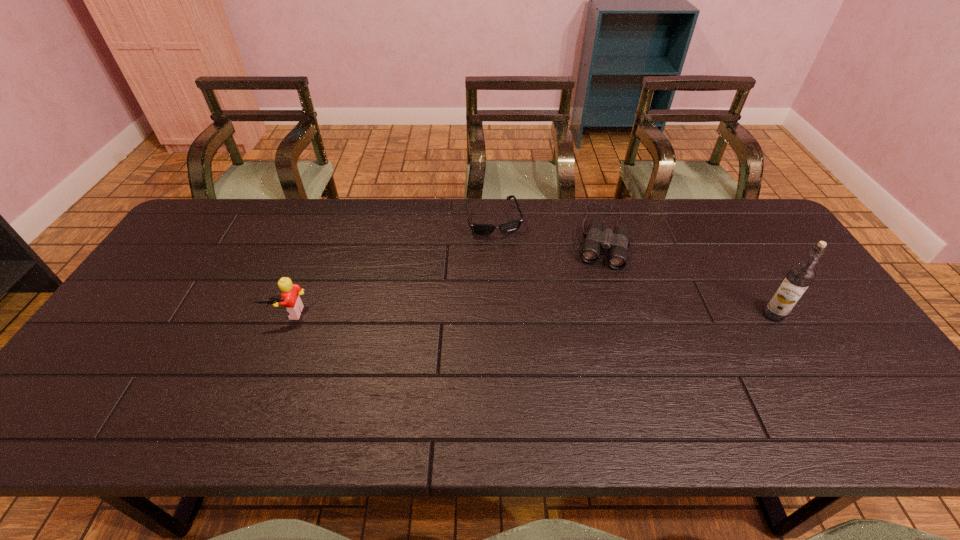
The height and width of the screenshot is (540, 960). Identify the location of Lego. (290, 299).

I want to click on the leftmost object, so click(x=290, y=299).

This screenshot has width=960, height=540. I want to click on the rightmost object, so click(798, 278).

This screenshot has height=540, width=960. Identify the location of the tallest object. (798, 278).

Image resolution: width=960 pixels, height=540 pixels. In order to click on the second object from left to right in this screenshot , I will do `click(479, 229)`.

Identify the location of binoculars. (617, 243).

This screenshot has width=960, height=540. Find the location of `vacant space positioned 0.150m in front of the leftmost object with the accessory visible`. vacant space positioned 0.150m in front of the leftmost object with the accessory visible is located at coordinates (264, 375).

Identify the location of vacant position located 0.120m on the label of the vodka. (717, 315).

You are a GUI agent. You are given a task and a screenshot of the screen. Output one action in this format:
    pyautogui.click(x=<x>, y=<y>)
    Task: Click on the free location located on the label of the vodka
    Image resolution: width=960 pixels, height=540 pixels.
    Given the screenshot: What is the action you would take?
    pyautogui.click(x=691, y=315)

Identify the location of vacant space positioned 0.200m on the label of the vodka. The width and height of the screenshot is (960, 540). (687, 315).